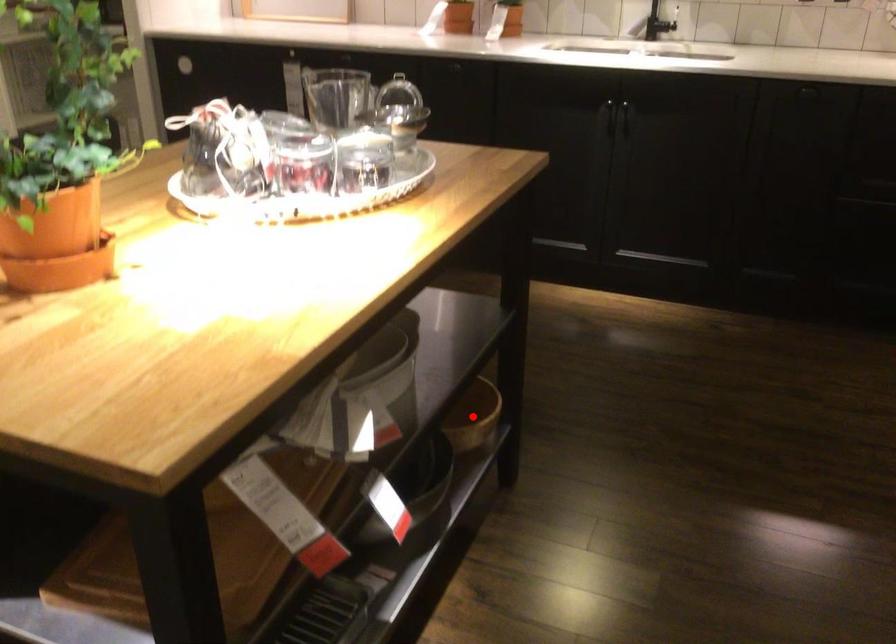
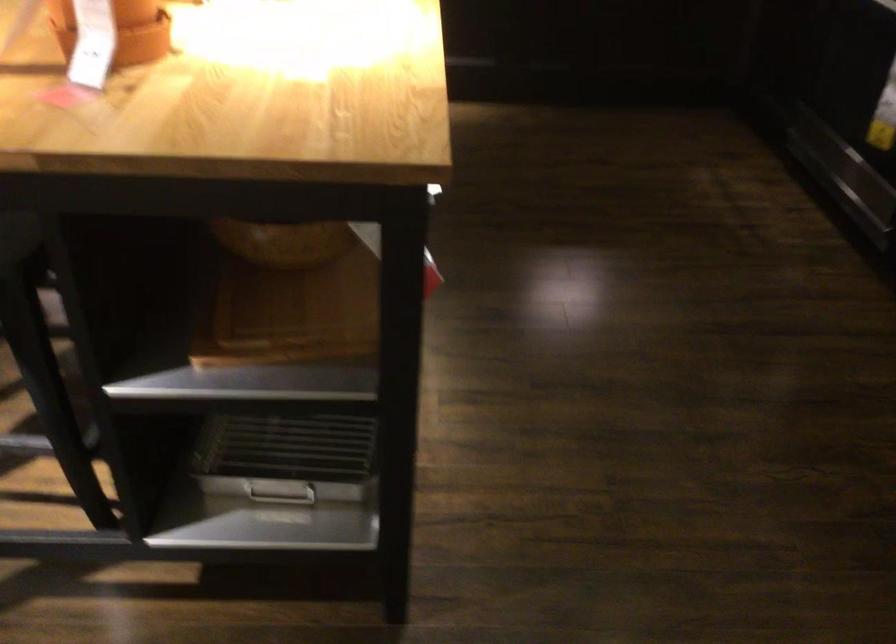
Question: I am providing you with two images of the same scene from different viewpoints. A red point is marked on the first image. Can you still see the location of the red point in image 2?

Choices:
 (A) Yes
 (B) No

Answer: (B)